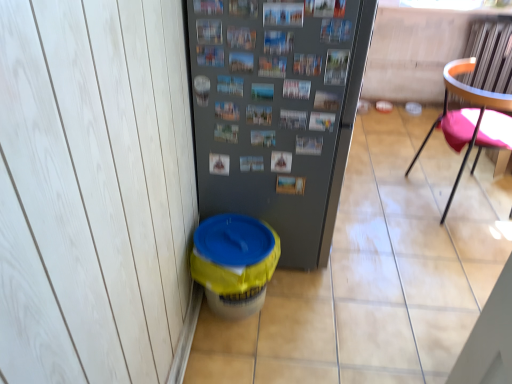
Question: Is point (475, 87) positioned closer to the camera than point (305, 31)?

Choices:
 (A) closer
 (B) farther

Answer: (B)

Question: Considering their positions, is orange plastic chair at right located in front of or behind metallic gray refrigerator at center?

Choices:
 (A) behind
 (B) front

Answer: (A)

Question: Considering the real-world distances, which object is farthest from the orange plastic chair at right?

Choices:
 (A) yellow plastic potty at lower left
 (B) metallic gray refrigerator at center

Answer: (A)

Question: Which of these objects is positioned closest to the metallic gray refrigerator at center?

Choices:
 (A) yellow plastic potty at lower left
 (B) orange plastic chair at right

Answer: (A)